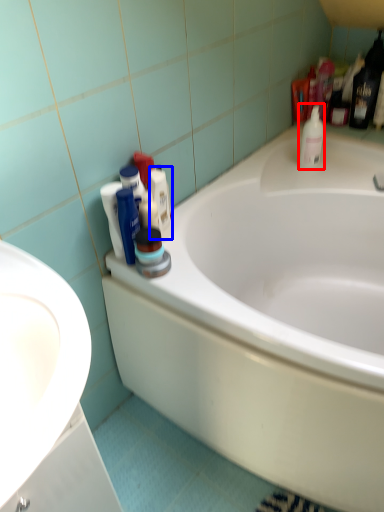
Question: Which of the following is the closest to the observer, cleaning product (highlighted by a red box) or toiletry (highlighted by a blue box)?

Choices:
 (A) cleaning product
 (B) toiletry

Answer: (B)